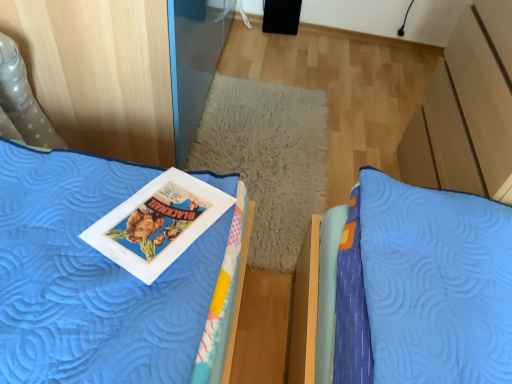
Question: Is blue quilted bed at upper left surrounded by blue quilted pillow at center?

Choices:
 (A) yes
 (B) no

Answer: (B)

Question: From a real-world perspective, is blue quilted pillow at center under blue quilted bed at upper left?

Choices:
 (A) yes
 (B) no

Answer: (A)

Question: Considering the relative sizes of blue quilted pillow at center and blue quilted bed at upper left in the image provided, is blue quilted pillow at center shorter than blue quilted bed at upper left?

Choices:
 (A) yes
 (B) no

Answer: (A)

Question: Would you say blue quilted pillow at center is a long distance from blue quilted bed at upper left?

Choices:
 (A) no
 (B) yes

Answer: (A)

Question: Can you see blue quilted pillow at center touching blue quilted bed at upper left?

Choices:
 (A) no
 (B) yes

Answer: (A)

Question: Does blue quilted pillow at center lie behind blue quilted bed at upper left?

Choices:
 (A) yes
 (B) no

Answer: (A)

Question: Considering the relative sizes of matte paper comic book at center-left and blue quilted pillow at center in the image provided, is matte paper comic book at center-left smaller than blue quilted pillow at center?

Choices:
 (A) yes
 (B) no

Answer: (A)

Question: From a real-world perspective, is matte paper comic book at center-left beneath blue quilted pillow at center?

Choices:
 (A) no
 (B) yes

Answer: (A)

Question: Is matte paper comic book at center-left far away from blue quilted pillow at center?

Choices:
 (A) no
 (B) yes

Answer: (A)

Question: Is matte paper comic book at center-left at the right side of blue quilted pillow at center?

Choices:
 (A) no
 (B) yes

Answer: (A)

Question: From the image's perspective, is matte paper comic book at center-left on blue quilted pillow at center?

Choices:
 (A) yes
 (B) no

Answer: (B)

Question: From a real-world perspective, is matte paper comic book at center-left located higher than blue quilted pillow at center?

Choices:
 (A) yes
 (B) no

Answer: (A)

Question: Is blue quilted bed at upper left to the left of matte paper comic book at center-left from the viewer's perspective?

Choices:
 (A) yes
 (B) no

Answer: (A)